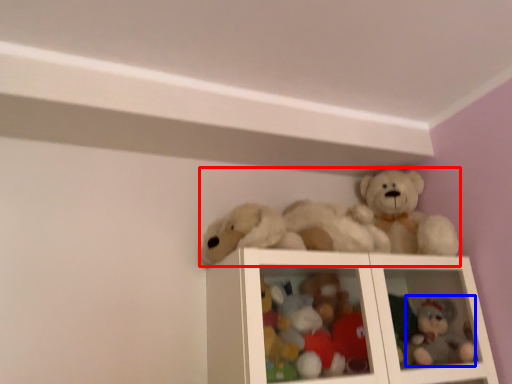
Question: Which object is closer to the camera taking this photo, toy (highlighted by a red box) or toy (highlighted by a blue box)?

Choices:
 (A) toy
 (B) toy

Answer: (A)